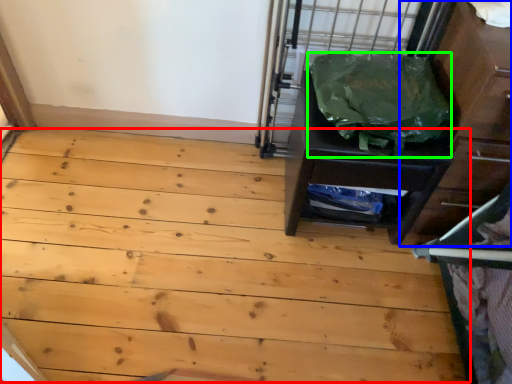
Question: Which is farther away from plywood (highlighted by a red box)? dresser (highlighted by a blue box) or garbage (highlighted by a green box)?

Choices:
 (A) dresser
 (B) garbage

Answer: (A)